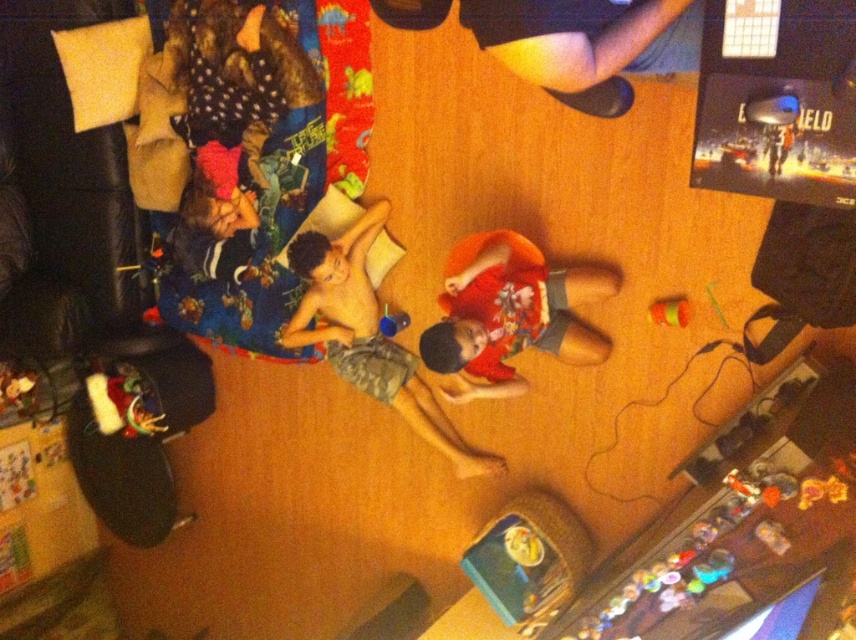
Which is in front, point (492, 284) or point (324, 282)?

Positioned in front is point (492, 284).

Can you confirm if orange cotton shirt at center is shorter than camouflage shorts at center?

Indeed, orange cotton shirt at center has a lesser height compared to camouflage shorts at center.

Find the location of a particular element. orange cotton shirt at center is located at coordinates (513, 317).

I want to click on orange cotton shirt at center, so click(x=513, y=317).

Does point (574, 68) come farther from viewer compared to point (482, 243)?

No, (574, 68) is closer to viewer.

Can you confirm if black leather shoes at upper right is positioned to the right of orange cotton shirt at center?

Correct, you'll find black leather shoes at upper right to the right of orange cotton shirt at center.

Who is more distant from viewer, [562,74] or [485,360]?

Positioned behind is point [485,360].

This screenshot has width=856, height=640. Identify the location of black leather shoes at upper right. (587, 44).

Between point (611, 29) and point (360, 228), which one is positioned behind?

The point (360, 228) is more distant.

I want to click on black leather shoes at upper right, so click(x=587, y=44).